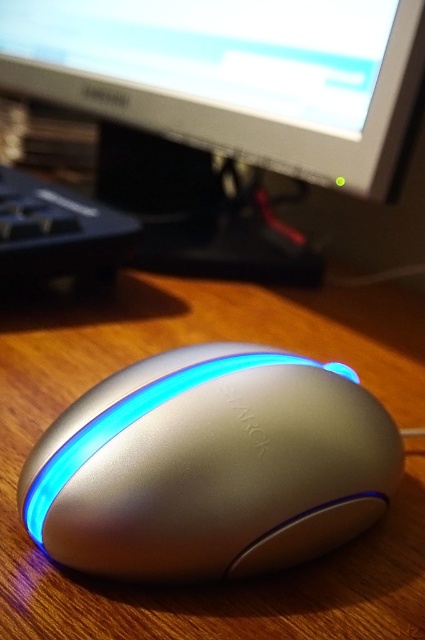
Question: Among these objects, which one is nearest to the camera?

Choices:
 (A) black plastic keyboard at lower left
 (B) matte black monitor at upper center
 (C) satin silver mouse at center

Answer: (C)

Question: Based on their relative distances, which object is nearer to the satin silver mouse at center?

Choices:
 (A) matte black monitor at upper center
 (B) black plastic keyboard at lower left

Answer: (B)

Question: Considering the relative positions of matte black monitor at upper center and black plastic keyboard at lower left in the image provided, where is matte black monitor at upper center located with respect to black plastic keyboard at lower left?

Choices:
 (A) left
 (B) right

Answer: (B)

Question: Does matte black monitor at upper center appear over black plastic keyboard at lower left?

Choices:
 (A) yes
 (B) no

Answer: (A)

Question: Is satin silver mouse at center below black plastic keyboard at lower left?

Choices:
 (A) no
 (B) yes

Answer: (B)

Question: Which point is closer to the camera taking this photo?

Choices:
 (A) (240, 248)
 (B) (25, 230)

Answer: (B)